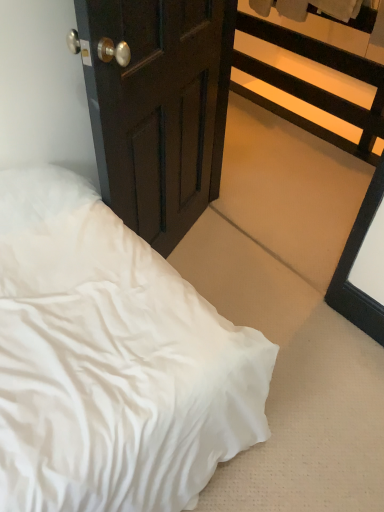
Question: Is dark wood door at center not close to black wood balustrade at upper right?

Choices:
 (A) no
 (B) yes

Answer: (B)

Question: Can you confirm if dark wood door at center is smaller than black wood balustrade at upper right?

Choices:
 (A) yes
 (B) no

Answer: (A)

Question: Does dark wood door at center have a greater width compared to black wood balustrade at upper right?

Choices:
 (A) no
 (B) yes

Answer: (A)

Question: Does dark wood door at center have a larger size compared to black wood balustrade at upper right?

Choices:
 (A) yes
 (B) no

Answer: (B)

Question: From a real-world perspective, is dark wood door at center on top of black wood balustrade at upper right?

Choices:
 (A) no
 (B) yes

Answer: (B)

Question: Relative to dark wood door at center, is black wood balustrade at upper right in front or behind?

Choices:
 (A) behind
 (B) front

Answer: (A)

Question: Considering the positions of point (251, 96) and point (180, 7), is point (251, 96) closer or farther from the camera than point (180, 7)?

Choices:
 (A) farther
 (B) closer

Answer: (A)

Question: Based on their positions, is black wood balustrade at upper right located to the left or right of dark wood door at center?

Choices:
 (A) left
 (B) right

Answer: (B)

Question: Is black wood balustrade at upper right inside or outside of dark wood door at center?

Choices:
 (A) inside
 (B) outside

Answer: (B)

Question: From the image's perspective, is dark wood door at center located above or below black wood balustrade at upper right?

Choices:
 (A) below
 (B) above

Answer: (A)

Question: Visually, is dark wood door at center positioned to the left or to the right of black wood balustrade at upper right?

Choices:
 (A) left
 (B) right

Answer: (A)

Question: Looking at their shapes, would you say dark wood door at center is wider or thinner than black wood balustrade at upper right?

Choices:
 (A) wide
 (B) thin

Answer: (B)

Question: From a real-world perspective, is dark wood door at center positioned above or below black wood balustrade at upper right?

Choices:
 (A) above
 (B) below

Answer: (A)

Question: Is black wood balustrade at upper right wider or thinner than white satin bed at lower left?

Choices:
 (A) wide
 (B) thin

Answer: (B)

Question: From their relative heights in the image, would you say black wood balustrade at upper right is taller or shorter than white satin bed at lower left?

Choices:
 (A) tall
 (B) short

Answer: (A)